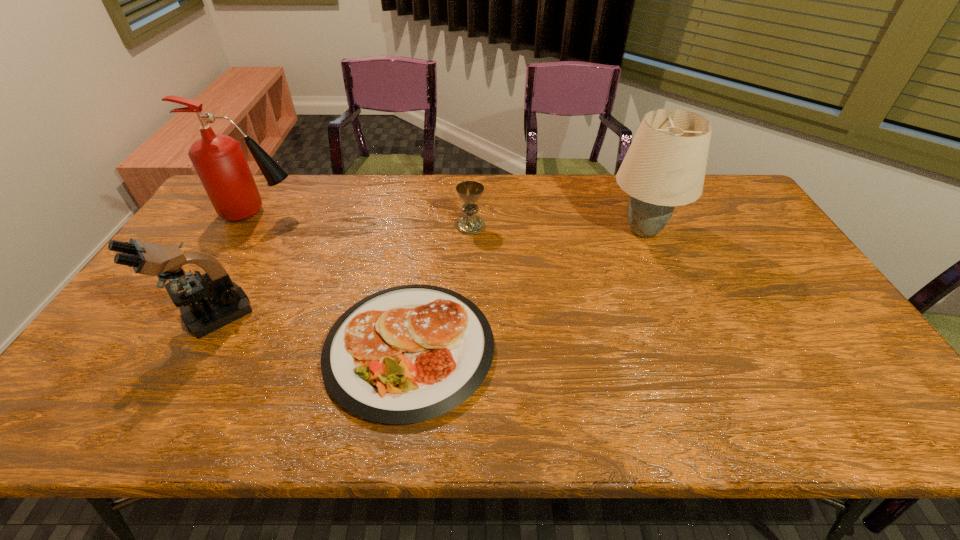
Find the location of a particular element. fire extinguisher present at the far edge is located at coordinates (219, 161).

At what (x,y) coordinates should I click in order to perform the action: click on lampshade at the far edge. Please return your answer as a coordinate pair (x, y). The width and height of the screenshot is (960, 540). Looking at the image, I should click on (665, 165).

Where is `object at the near edge`? This screenshot has width=960, height=540. object at the near edge is located at coordinates (407, 354).

Find the location of `fire extinguisher positioned at the left edge`. fire extinguisher positioned at the left edge is located at coordinates (219, 161).

You are a GUI agent. You are given a task and a screenshot of the screen. Output one action in this format:
    pyautogui.click(x=<x>, y=<y>)
    Task: Click on the microscope located at the left edge
    
    Given the screenshot: What is the action you would take?
    pyautogui.click(x=208, y=303)

This screenshot has width=960, height=540. Find the location of `object located in the far left corner section of the desktop`. object located in the far left corner section of the desktop is located at coordinates (219, 161).

Image resolution: width=960 pixels, height=540 pixels. Identify the location of vacant area at the far edge of the desktop. (496, 192).

Identify the location of vacant space at the near edge of the desktop. The height and width of the screenshot is (540, 960). (647, 430).

Image resolution: width=960 pixels, height=540 pixels. In the image, there is a desktop. What are the coordinates of `blank space at the right edge` in the screenshot? It's located at (781, 320).

In order to click on free region at the near left corner in this screenshot , I will do `click(76, 428)`.